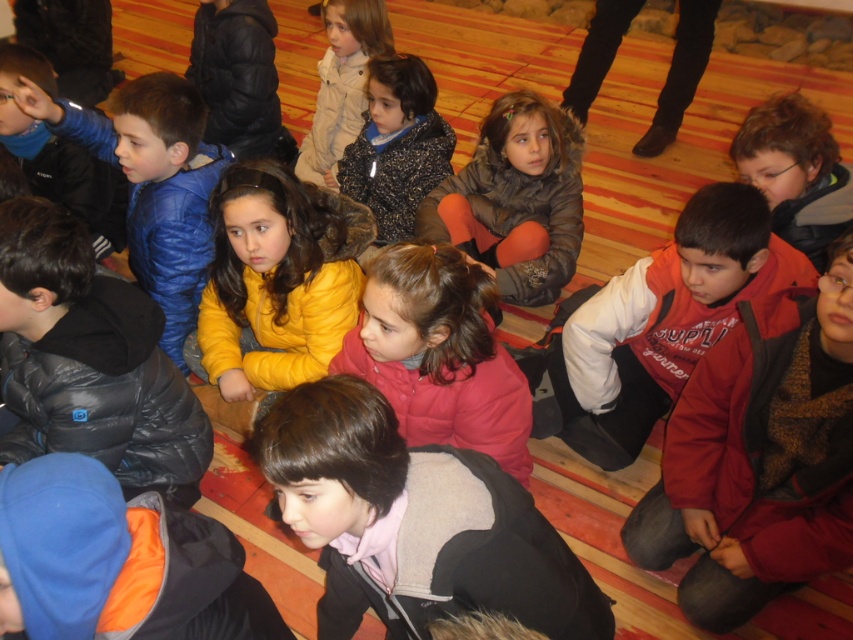
Which is below, matte gray vest at center or red fleece jacket at center?

Positioned lower is matte gray vest at center.

Can you confirm if matte gray vest at center is taller than red fleece jacket at center?

In fact, matte gray vest at center may be shorter than red fleece jacket at center.

Is point (440, 531) positioned after point (668, 365)?

No, it is in front of (668, 365).

The height and width of the screenshot is (640, 853). In order to click on matte gray vest at center in this screenshot , I will do `click(415, 522)`.

Who is more distant from viewer, (828, 380) or (386, 332)?

The point (828, 380) is behind.

Can you confirm if red fleece jacket at lower right is taller than matte red jacket at center?

Correct, red fleece jacket at lower right is much taller as matte red jacket at center.

The height and width of the screenshot is (640, 853). I want to click on red fleece jacket at lower right, so coord(758,456).

Between red fleece jacket at lower right and light beige jacket at center, which one is positioned lower?

Positioned lower is red fleece jacket at lower right.

Does red fleece jacket at lower right appear on the right side of light beige jacket at center?

Yes, red fleece jacket at lower right is to the right of light beige jacket at center.

Is point (775, 554) positioned before point (329, 60)?

Yes, point (775, 554) is closer to viewer.

Locate an element on the screen. This screenshot has height=640, width=853. red fleece jacket at lower right is located at coordinates (758, 456).